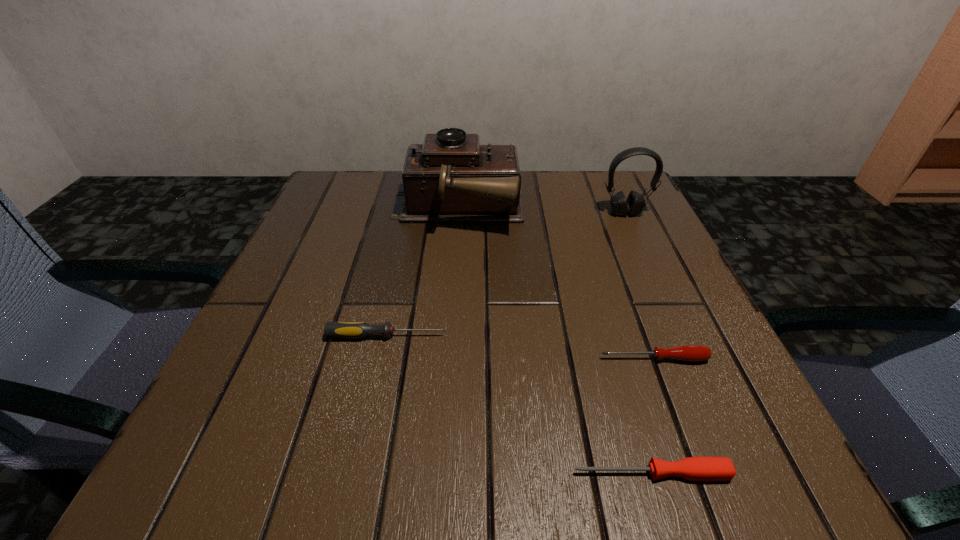
Where is `vacant region located 0.070m at the tip of the nearest screwdriver`? The image size is (960, 540). vacant region located 0.070m at the tip of the nearest screwdriver is located at coordinates (517, 474).

Locate an element on the screen. This screenshot has height=540, width=960. blank area located at the tip of the nearest screwdriver is located at coordinates (349, 474).

Where is `free space located at the tip of the nearest screwdriver`? free space located at the tip of the nearest screwdriver is located at coordinates (493, 474).

This screenshot has height=540, width=960. I want to click on phonograph_record located at the far edge, so click(450, 178).

What are the coordinates of `headset positioned at the far edge` in the screenshot? It's located at (635, 203).

The image size is (960, 540). In order to click on object located at the near edge in this screenshot , I will do `click(700, 468)`.

The image size is (960, 540). Identify the location of object that is at the left edge. (356, 330).

At what (x,y) coordinates should I click in order to perform the action: click on headset positioned at the right edge. Please return your answer as a coordinate pair (x, y). Image resolution: width=960 pixels, height=540 pixels. Looking at the image, I should click on (635, 203).

Find the location of a particular element. This screenshot has height=540, width=960. object that is at the far right corner is located at coordinates (635, 203).

At what (x,y) coordinates should I click in order to perform the action: click on object positioned at the near right corner. Please return your answer as a coordinate pair (x, y). This screenshot has height=540, width=960. Looking at the image, I should click on (700, 468).